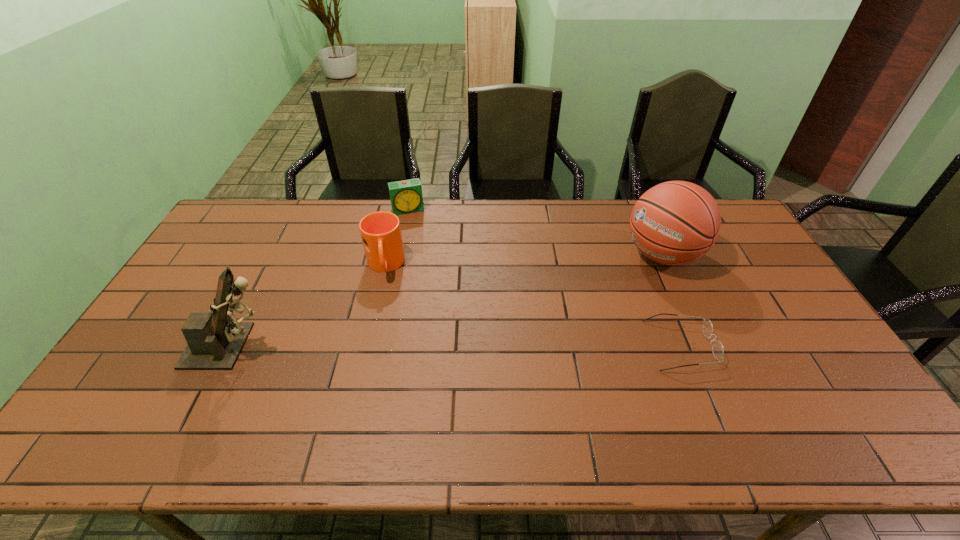
The height and width of the screenshot is (540, 960). In order to click on vacant space at the far edge in this screenshot , I will do `click(333, 233)`.

This screenshot has height=540, width=960. In the image, there is a desktop. What are the coordinates of `vacant region at the near edge` in the screenshot? It's located at (210, 380).

The height and width of the screenshot is (540, 960). I want to click on blank area at the left edge, so click(206, 261).

Identify the location of free space at the right edge of the desktop. (801, 318).

In the image, there is a desktop. Identify the location of vacant space at the far left corner. (271, 208).

Find the location of `vacant region at the near right corner of the desktop`. vacant region at the near right corner of the desktop is located at coordinates (814, 390).

I want to click on free spot between the basketball and the spectacles, so click(x=671, y=300).

At what (x,y) coordinates should I click in order to perform the action: click on vacant point located between the spectacles and the basketball. Please return your answer as a coordinate pair (x, y). The image size is (960, 540). Looking at the image, I should click on (671, 300).

You are a GUI agent. You are given a task and a screenshot of the screen. Output one action in this format:
    pyautogui.click(x=<x>, y=<y>)
    Task: Click on the free point between the alarm clock and the shortest object
    
    Given the screenshot: What is the action you would take?
    pyautogui.click(x=544, y=278)

Where is `empty location between the shortest object and the mug`? empty location between the shortest object and the mug is located at coordinates (533, 305).